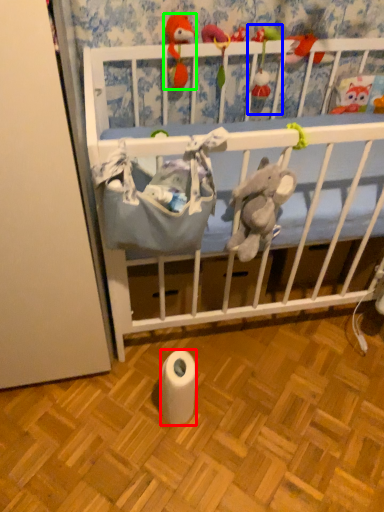
Question: Which is farther away from toilet paper (highlighted by a red box)? toy (highlighted by a blue box) or toy (highlighted by a green box)?

Choices:
 (A) toy
 (B) toy

Answer: (A)